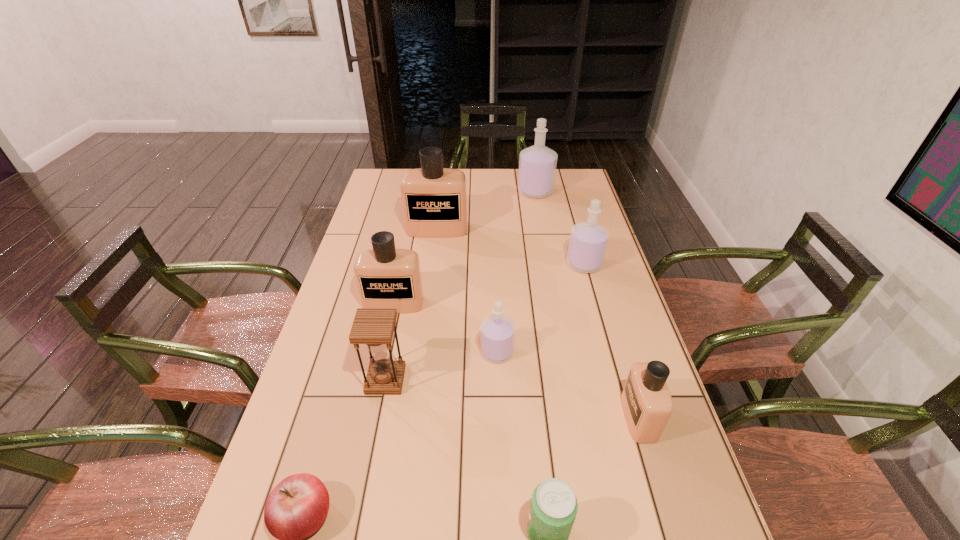
Select which perfume is the fourth closest to the smallest purple perfume. Please provide its 2D coordinates. Your answer should be formatted as a tuple, i.e. [(x, y)], where the tuple contains the x and y coordinates of a point satisfying the conditions above.

[(434, 201)]

Identify which perfume is located as the fifth nearest to the farthest perfume. Please provide its 2D coordinates. Your answer should be formatted as a tuple, i.e. [(x, y)], where the tuple contains the x and y coordinates of a point satisfying the conditions above.

[(647, 404)]

This screenshot has height=540, width=960. Identify the location of purple perfume that is the third closest to the sixth nearest object. (537, 164).

Identify the location of purple perfume that is the third closest to the second smallest beige perfume. (537, 164).

You are a GUI agent. You are given a task and a screenshot of the screen. Output one action in this format:
    pyautogui.click(x=<x>, y=<y>)
    Task: Click on the third closest beige perfume to the hourglass
    
    Given the screenshot: What is the action you would take?
    pyautogui.click(x=434, y=201)

Where is `beige perfume that can be found as the closest to the second smallest purple perfume`? The width and height of the screenshot is (960, 540). beige perfume that can be found as the closest to the second smallest purple perfume is located at coordinates (434, 201).

The width and height of the screenshot is (960, 540). In order to click on free point that satisfies the following two spatial constraints: 1. on the front label of the second farthest beige perfume; 2. on the right side of the fourth perfume from right to left in this screenshot , I will do coord(383,352).

The image size is (960, 540). What are the coordinates of `free point that satisfies the following two spatial constraints: 1. on the front label of the fifth nearest object; 2. on the right side of the second biggest beige perfume` in the screenshot? It's located at (383, 352).